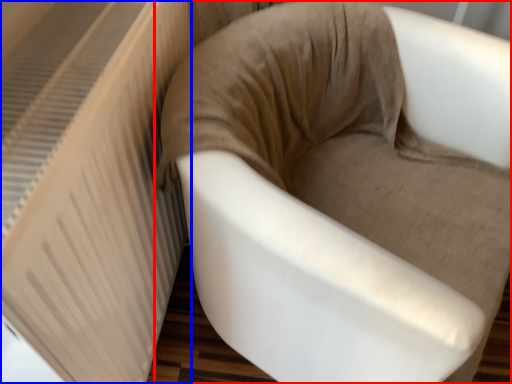
Question: Which object appears farthest to the camera in this image, chair (highlighted by a red box) or radiator (highlighted by a blue box)?

Choices:
 (A) chair
 (B) radiator

Answer: (A)